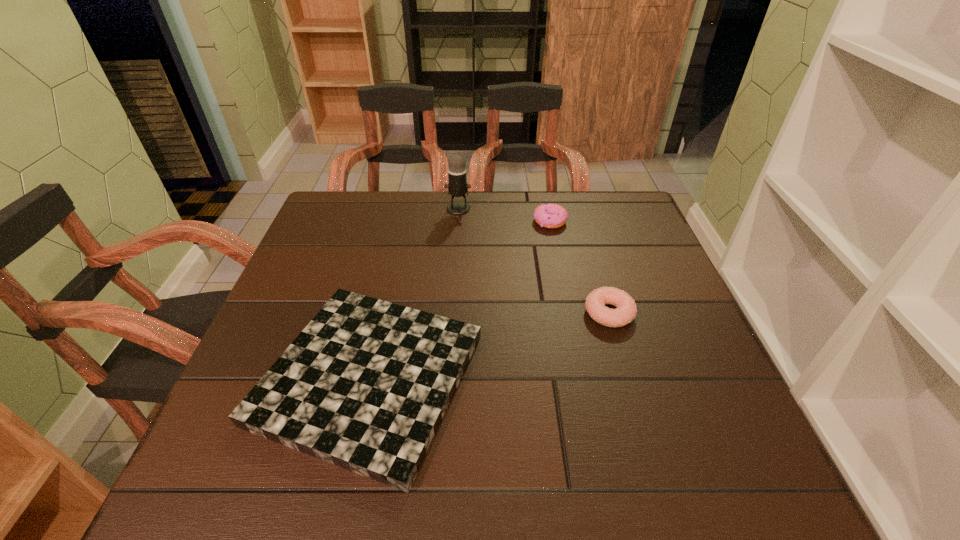
Where is `vacant space that's between the checkerboard and the tallest object`? vacant space that's between the checkerboard and the tallest object is located at coordinates (414, 293).

At what (x,y) coordinates should I click in order to perform the action: click on object that ranks as the second closest to the microphone. Please return your answer as a coordinate pair (x, y). The width and height of the screenshot is (960, 540). Looking at the image, I should click on (365, 385).

Identify which object is the nearest to the tallest object. Please provide its 2D coordinates. Your answer should be formatted as a tuple, i.e. [(x, y)], where the tuple contains the x and y coordinates of a point satisfying the conditions above.

[(549, 215)]

The height and width of the screenshot is (540, 960). Identify the location of vacant space that satisfies the following two spatial constraints: 1. on the front side of the farther doughnut; 2. on the right side of the tallest object. (458, 221).

I want to click on vacant space that satisfies the following two spatial constraints: 1. on the front side of the tallest object; 2. on the right side of the farther doughnut, so click(458, 221).